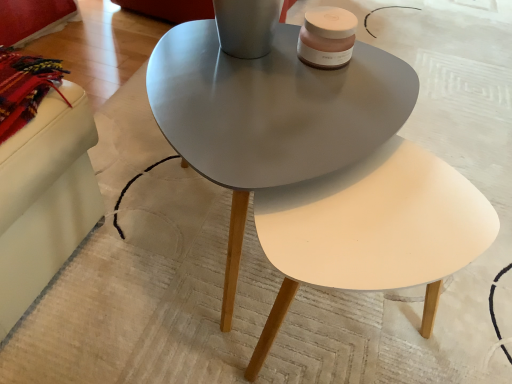
This screenshot has height=384, width=512. I want to click on empty space that is ontop of matte gray coffee table at center (from a real-world perspective), so click(279, 92).